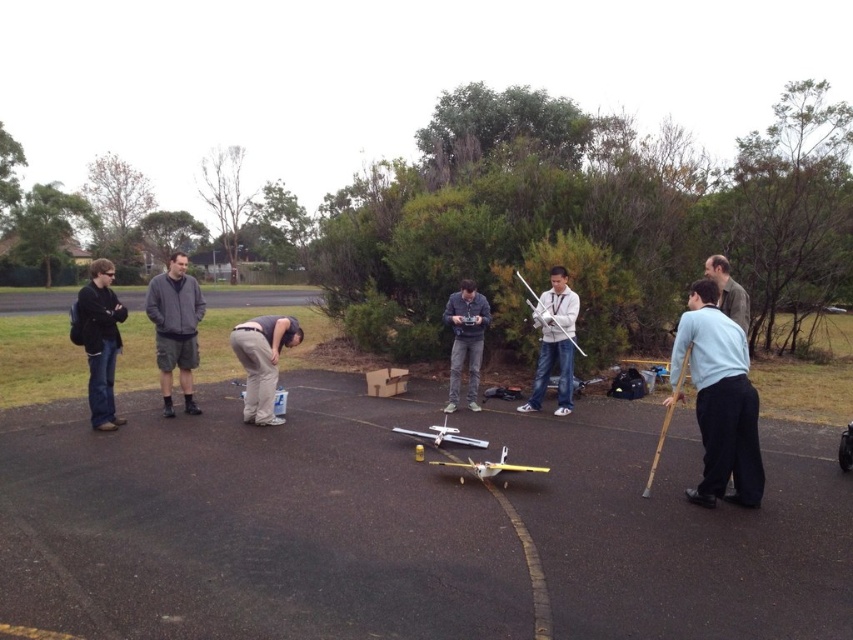
You are a photographer trying to capture a wide shot of the white matte remote control airplane at center and the tan fabric pants at center. Given that your camera can only focus on objects wider than 10 inches, will both objects be in focus?

The white matte remote control airplane at center is wider than the tan fabric pants at center. Since the camera focuses on objects wider than 10 inches, only the white matte remote control airplane at center will be in focus.

You are standing at the origin point of the coordinate system where the lower left corner of the image is the origin. The coordinates are normalized between 0 and 1. If you want to walk to the light blue fabric shirt at right, which direction should you move in terms of the coordinate system?

To reach the light blue fabric shirt at right located at coordinate point 0.625 on the x axis and 0.844 on the y axis, you should move towards increasing x and y directions from the origin.